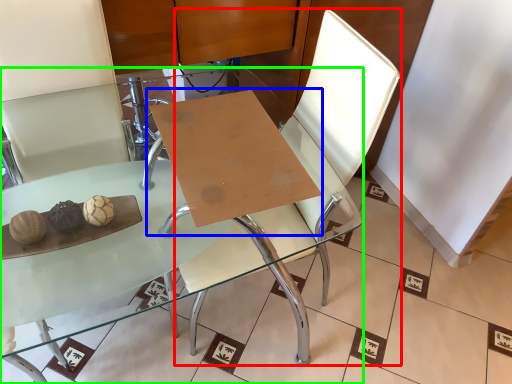
Question: Based on their relative distances, which object is nearer to swivel chair (highlighted by a red box)? Choose from table (highlighted by a blue box) and table (highlighted by a green box).

Choices:
 (A) table
 (B) table

Answer: (B)